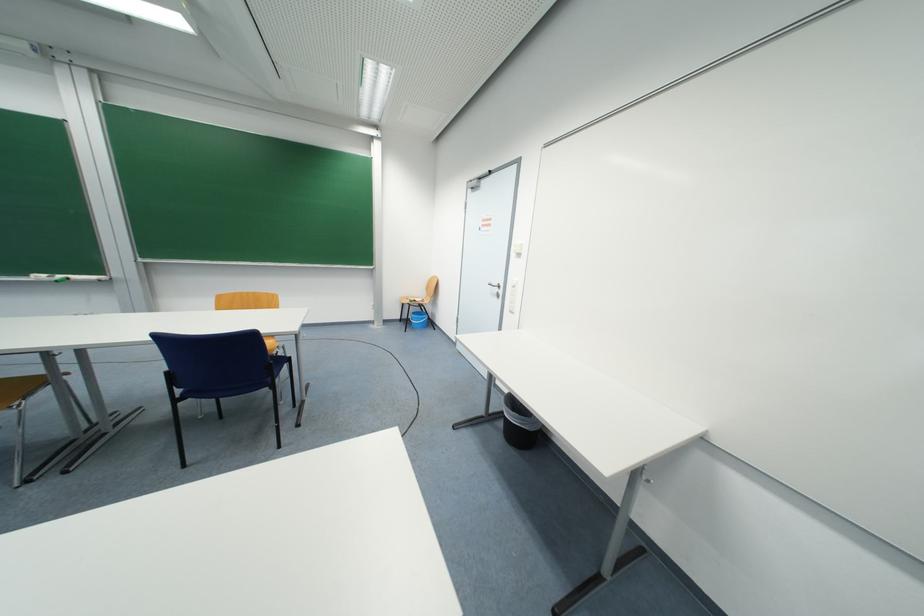
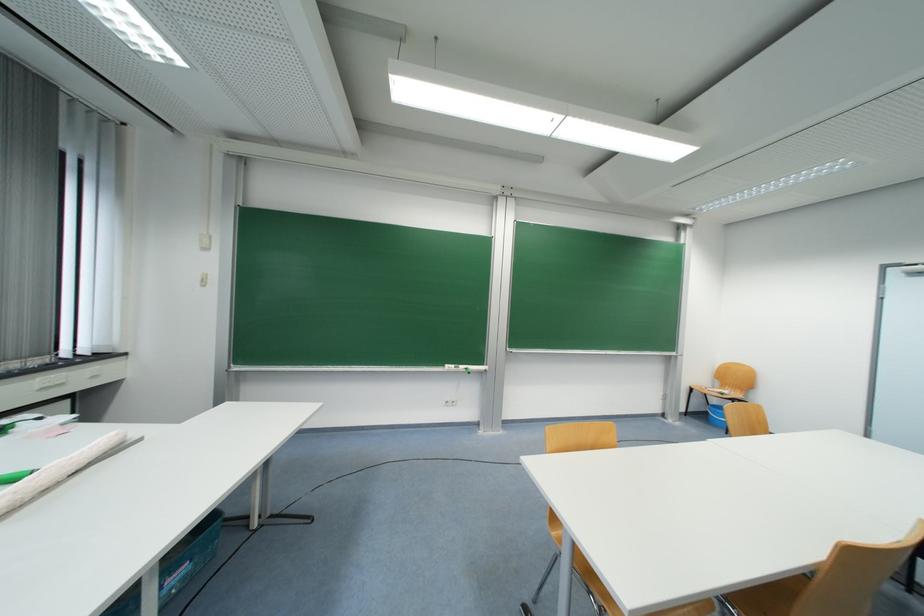
The point at (431, 304) is marked in the first image. Where is the corresponding point in the second image?

(743, 398)